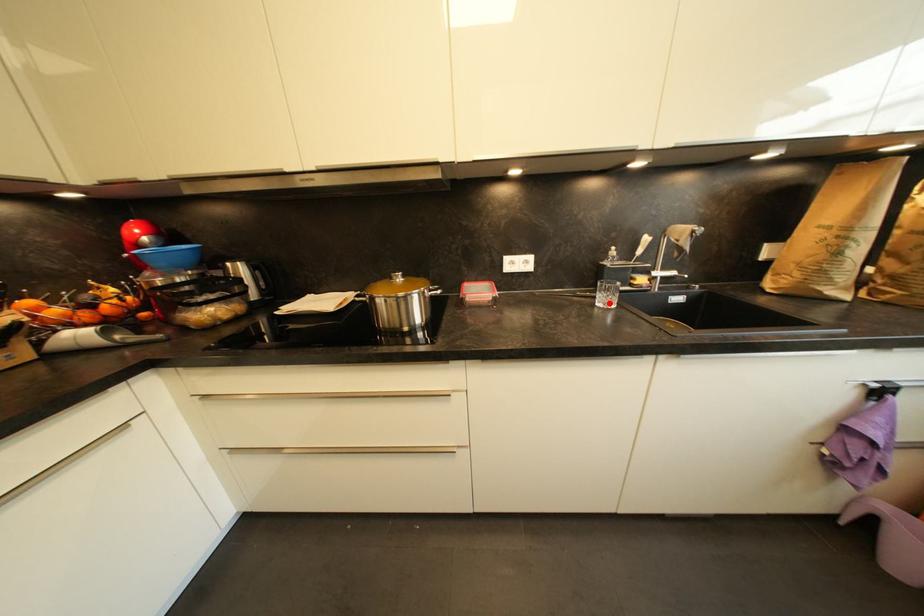
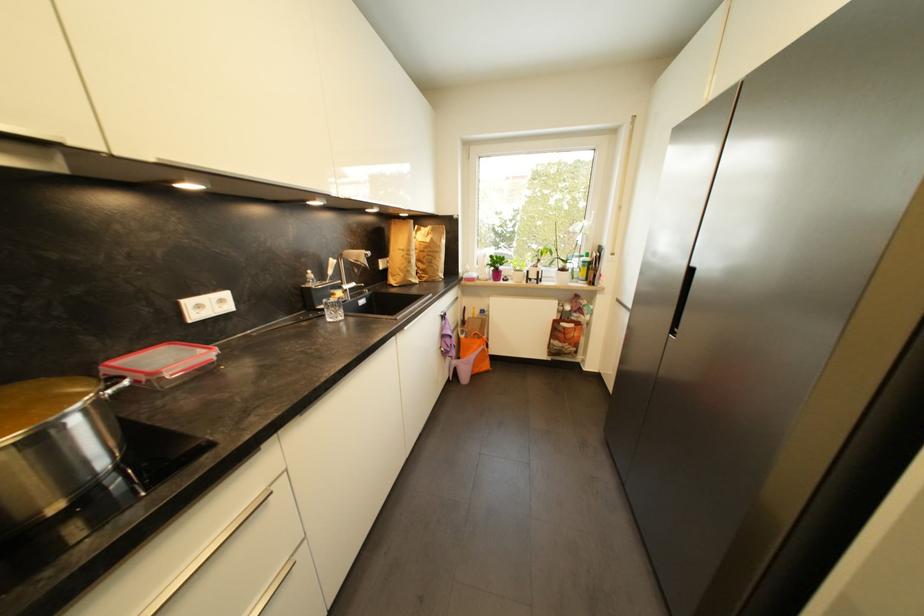
Where in the second image is the point corresponding to the highlighted location from the first image?

(339, 317)